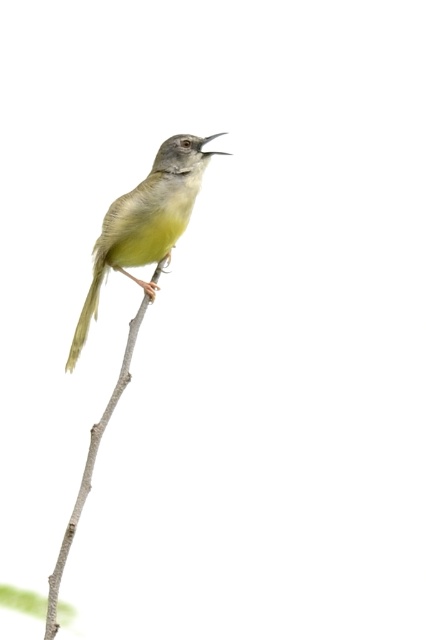
Which is above, yellow-green feathers at center or smooth gray branch at center?

yellow-green feathers at center is above.

Is yellow-green feathers at center taller than smooth gray branch at center?

Incorrect, yellow-green feathers at center's height is not larger of smooth gray branch at center's.

Who is more distant from viewer, (187, 177) or (164, 268)?

Point (164, 268)

The image size is (426, 640). Identify the location of yellow-green feathers at center. (146, 221).